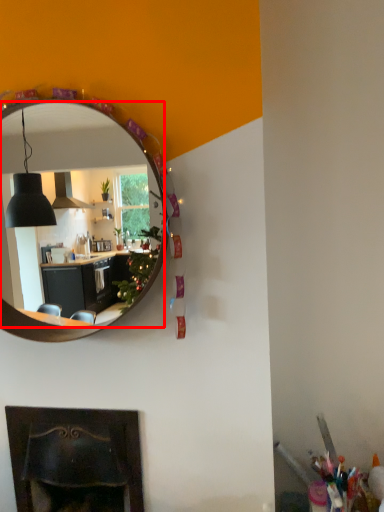
Question: Where is mirror (annotated by the red box) located in relation to fireplace in the image?

Choices:
 (A) right
 (B) left

Answer: (A)